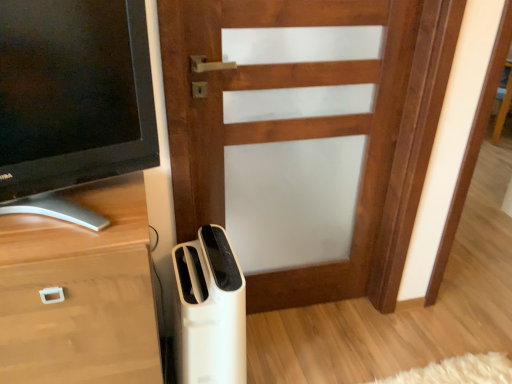
Question: Is white plastic air purifier at lower center situated inside wooden chest of drawers at lower left or outside?

Choices:
 (A) outside
 (B) inside

Answer: (A)

Question: Is white plastic air purifier at lower center in front of or behind wooden chest of drawers at lower left in the image?

Choices:
 (A) behind
 (B) front

Answer: (A)

Question: Which object is the closest to the matte black tv at left?

Choices:
 (A) wooden chest of drawers at lower left
 (B) white plastic air purifier at lower center
 (C) wooden door at center

Answer: (A)

Question: Estimate the real-world distances between objects in this image. Which object is closer to the wooden door at center?

Choices:
 (A) white plastic air purifier at lower center
 (B) wooden chest of drawers at lower left
 (C) matte black tv at left

Answer: (C)